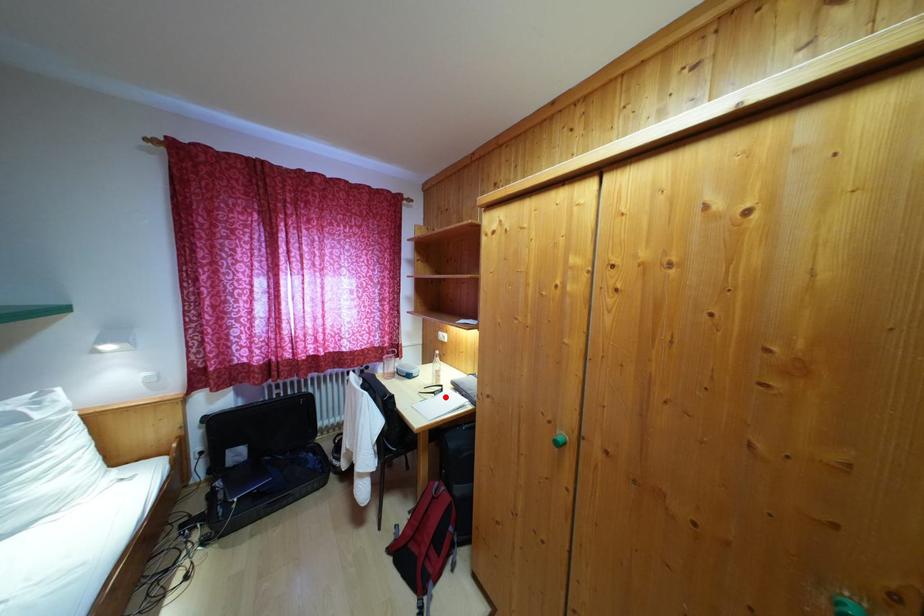
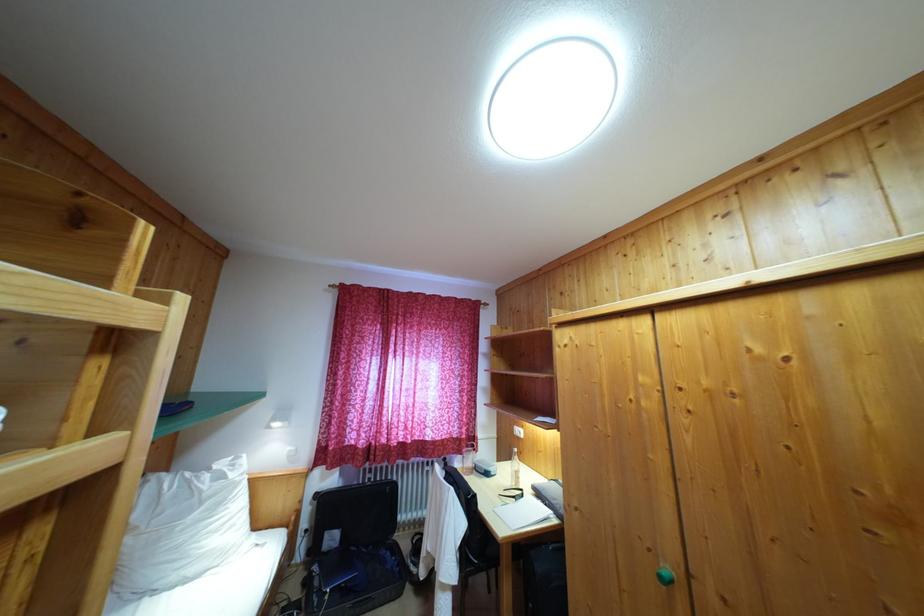
Where in the second image is the point corresponding to the highlighted location from the first image?

(526, 501)